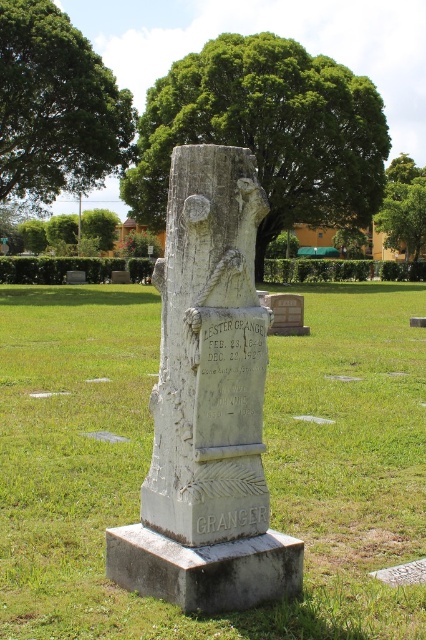
Between point (363, 97) and point (232, 522), which one is positioned behind?

The point (363, 97) is behind.

Which is in front, point (311, 72) or point (229, 522)?

Positioned in front is point (229, 522).

What are the coordinates of `green leafy tree at center` in the screenshot? It's located at (267, 131).

Is point (65, 124) behind point (265, 518)?

Yes, point (65, 124) is farther from viewer.

At what (x,y) coordinates should I click in order to perform the action: click on green leafy tree at upper left. Please return your answer as a coordinate pair (x, y). Looking at the image, I should click on (57, 106).

Is the position of white stone monument at center less distant than that of gray stone inscription at center?

Yes, white stone monument at center is closer to the viewer.

Is white stone monument at center positioned behind gray stone inscription at center?

That is False.

Is point (241, 285) in front of point (196, 516)?

That is False.

Where is `white stone monument at center`? The width and height of the screenshot is (426, 640). white stone monument at center is located at coordinates (207, 401).